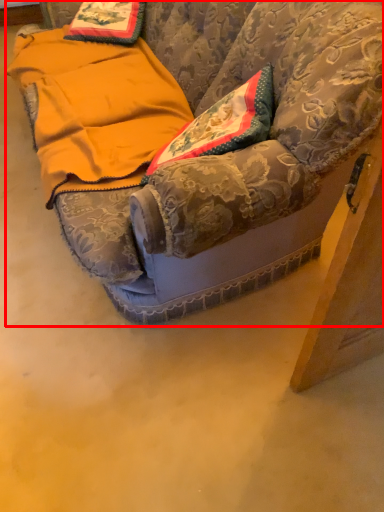
Question: From the image's perspective, what is the correct spatial relationship of furniture (annotated by the red box) in relation to blanket?

Choices:
 (A) below
 (B) above

Answer: (B)